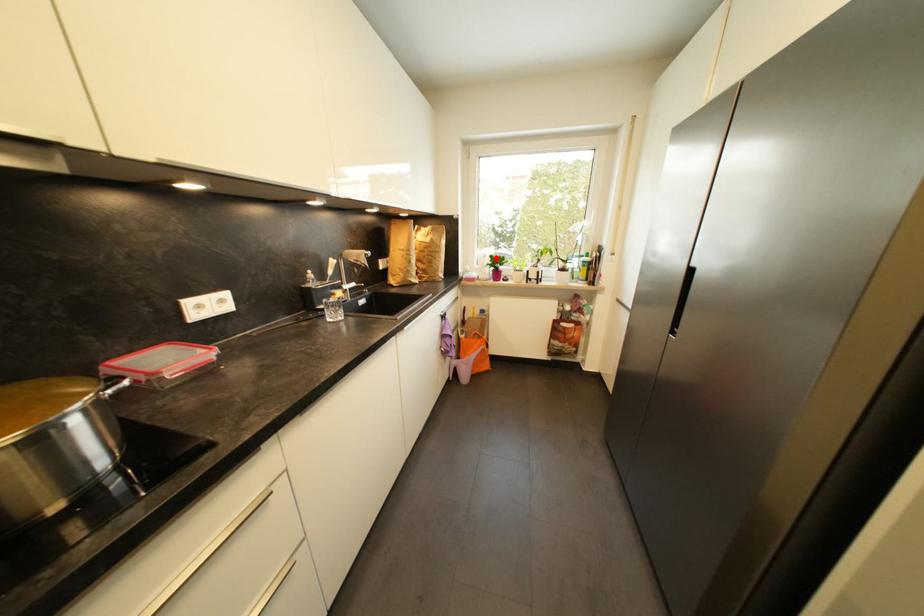
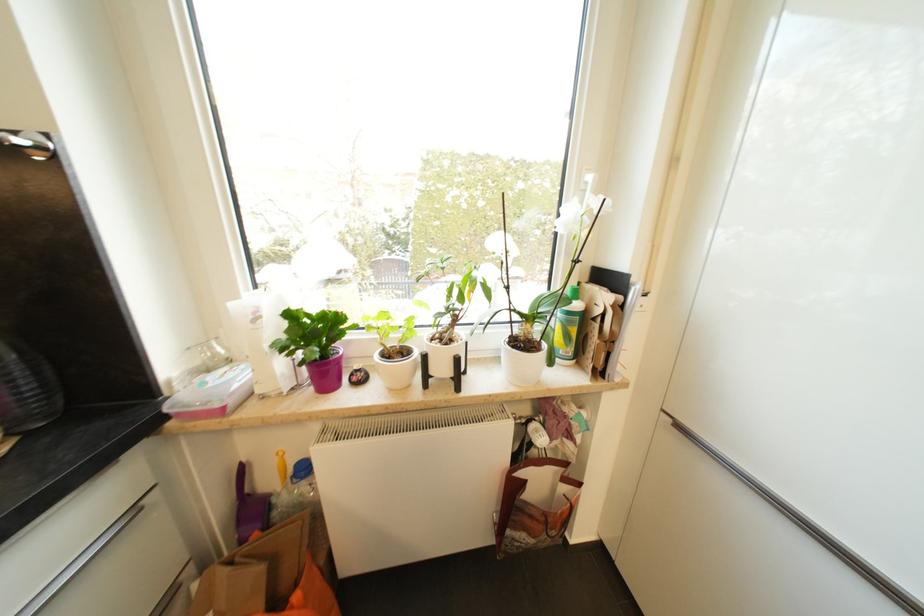
Find the pixel in the second image that matches the highlighted location in the first image.

(295, 317)